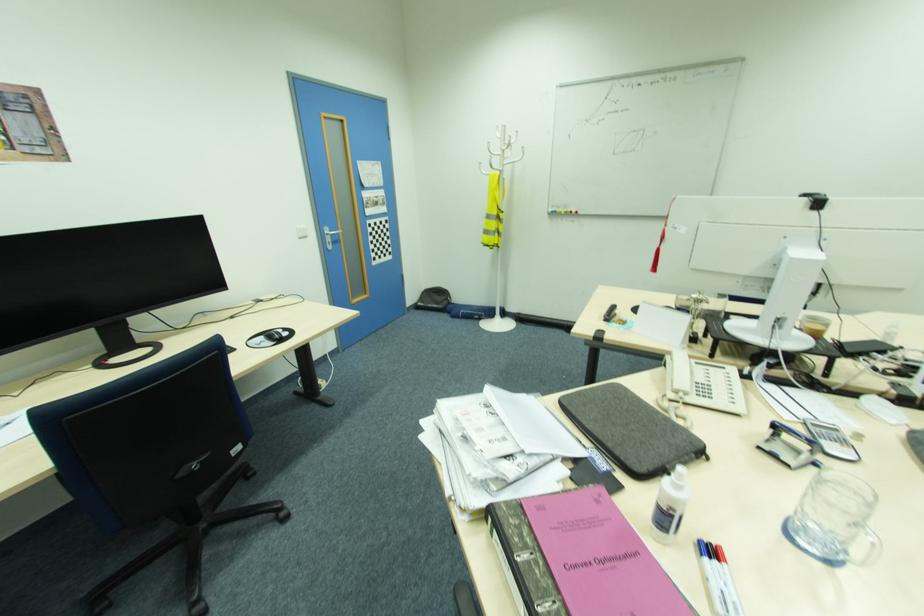
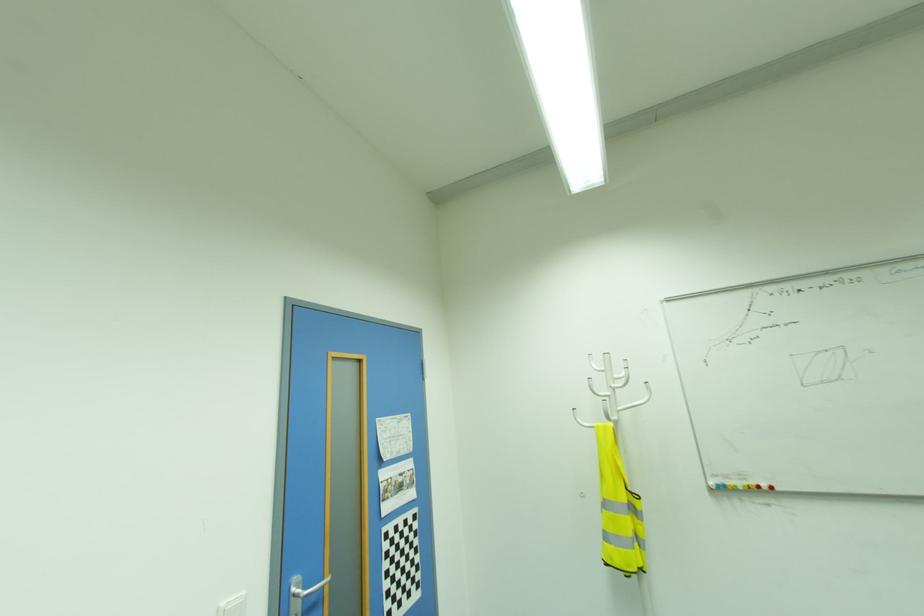
Where in the second image is the point corresponding to point 485,171 from the first image?

(589, 424)